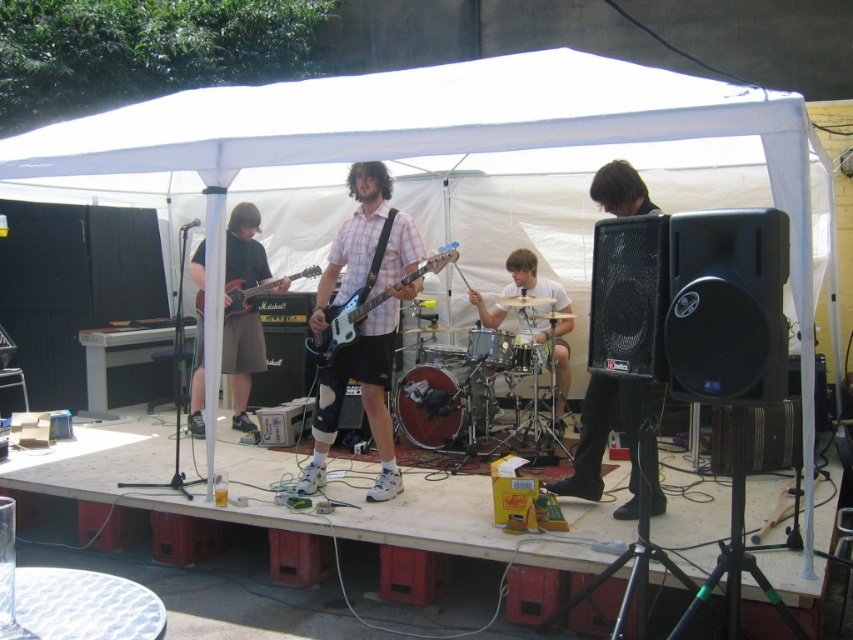
Does glossy electric guitar at center have a lesser height compared to matte black electric guitar at center?

Incorrect, glossy electric guitar at center's height does not fall short of matte black electric guitar at center's.

Between point (354, 314) and point (201, 300), which one is positioned behind?

Point (201, 300)

Find the location of a particular element. glossy electric guitar at center is located at coordinates (346, 317).

Does white drum set at center have a lesser height compared to glossy electric guitar at center?

Incorrect, white drum set at center's height does not fall short of glossy electric guitar at center's.

Is point (534, 280) less distant than point (338, 346)?

No, it is not.

At what (x,y) coordinates should I click in order to perform the action: click on white drum set at center. Please return your answer as a coordinate pair (x, y). Looking at the image, I should click on (532, 282).

Consider the image. Is black matte speaker at right positioned at the back of white drum set at center?

No, it is in front of white drum set at center.

Is black matte speaker at right closer to camera compared to white drum set at center?

Yes, black matte speaker at right is in front of white drum set at center.

Describe the element at coordinates (605, 440) in the screenshot. I see `black matte speaker at right` at that location.

Where is `black matte speaker at right`? Image resolution: width=853 pixels, height=640 pixels. black matte speaker at right is located at coordinates (605, 440).